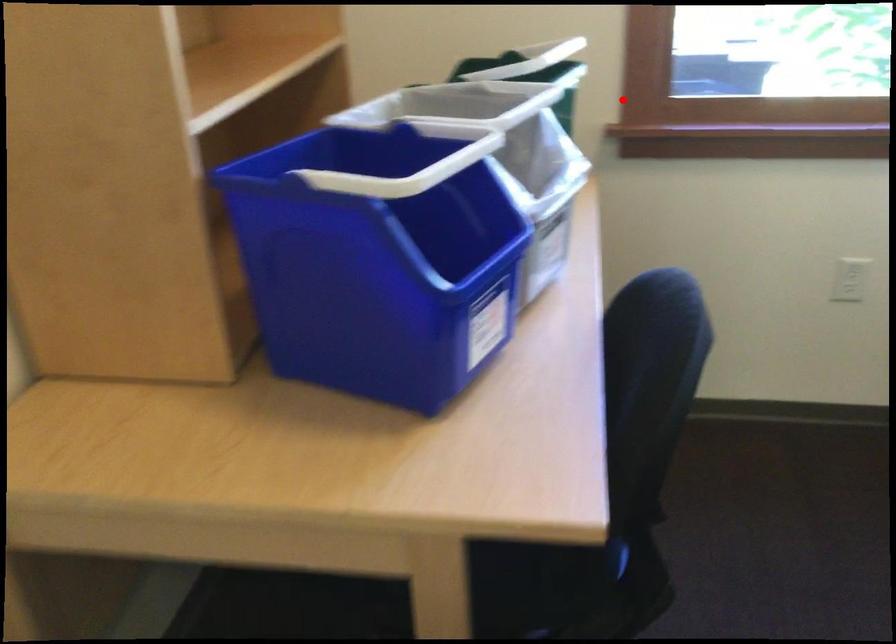
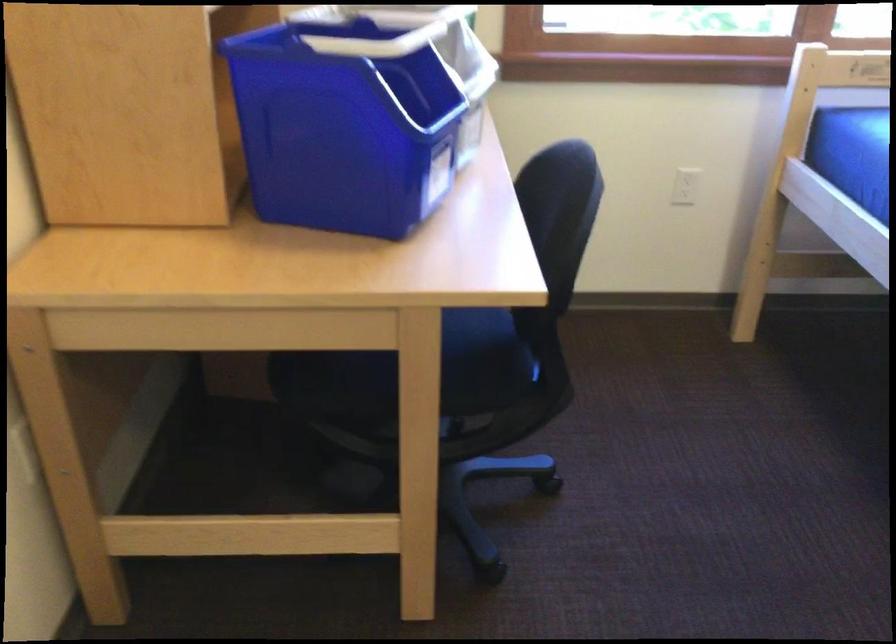
Question: I am providing you with two images of the same scene from different viewpoints. In image1, a red point is highlighted. Considering the same 3D point in image2, which of the following is correct?

Choices:
 (A) It is closer
 (B) It is farther

Answer: (B)